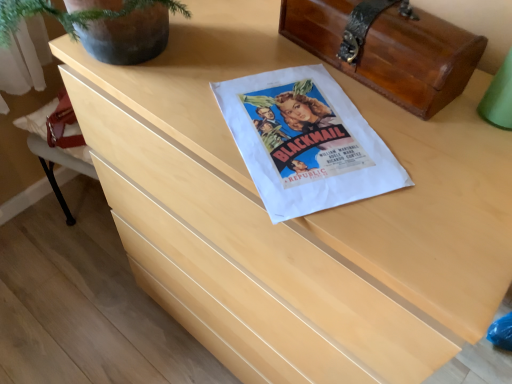
Question: Considering the relative sizes of shiny brown wood chest at upper right and white paper flyer at center in the image provided, is shiny brown wood chest at upper right shorter than white paper flyer at center?

Choices:
 (A) yes
 (B) no

Answer: (B)

Question: From a real-world perspective, is shiny brown wood chest at upper right beneath white paper flyer at center?

Choices:
 (A) no
 (B) yes

Answer: (A)

Question: Can you confirm if shiny brown wood chest at upper right is smaller than white paper flyer at center?

Choices:
 (A) no
 (B) yes

Answer: (A)

Question: Does shiny brown wood chest at upper right have a larger size compared to white paper flyer at center?

Choices:
 (A) no
 (B) yes

Answer: (B)

Question: Is shiny brown wood chest at upper right positioned with its back to white paper flyer at center?

Choices:
 (A) no
 (B) yes

Answer: (A)

Question: From the image's perspective, is shiny brown wood chest at upper right below white paper flyer at center?

Choices:
 (A) yes
 (B) no

Answer: (B)

Question: Is white paper flyer at center positioned beyond the bounds of shiny brown wood chest at upper right?

Choices:
 (A) yes
 (B) no

Answer: (A)

Question: Is white paper flyer at center taller than shiny brown wood chest at upper right?

Choices:
 (A) no
 (B) yes

Answer: (A)

Question: From the image's perspective, is white paper flyer at center below shiny brown wood chest at upper right?

Choices:
 (A) yes
 (B) no

Answer: (A)

Question: Are white paper flyer at center and shiny brown wood chest at upper right making contact?

Choices:
 (A) yes
 (B) no

Answer: (B)

Question: Does white paper flyer at center come in front of shiny brown wood chest at upper right?

Choices:
 (A) yes
 (B) no

Answer: (A)

Question: Is shiny brown wood chest at upper right at the back of white paper flyer at center?

Choices:
 (A) no
 (B) yes

Answer: (A)

Question: In terms of width, does shiny brown wood chest at upper right look wider or thinner when compared to white paper flyer at center?

Choices:
 (A) wide
 (B) thin

Answer: (B)